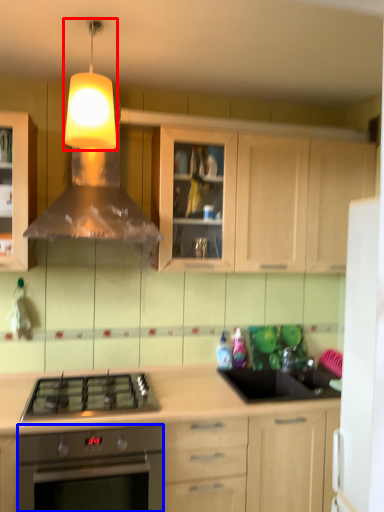
Question: Among these objects, which one is nearest to the camera, light fixture (highlighted by a red box) or oven (highlighted by a blue box)?

Choices:
 (A) light fixture
 (B) oven

Answer: (A)